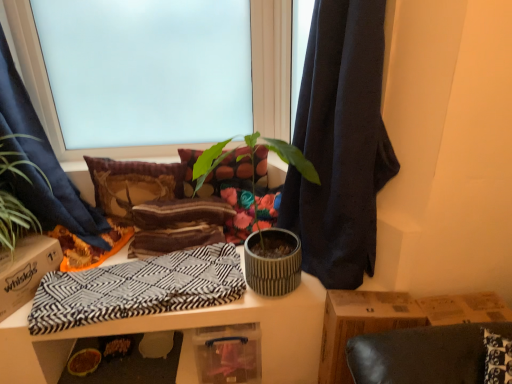
Question: Considering the relative positions of dark blue fabric at center, which ranks as the second curtain in left-to-right order, and textured concrete pot at center, which is the 1th houseplant in right-to-left order, in the image provided, is dark blue fabric at center, which ranks as the second curtain in left-to-right order, to the right of textured concrete pot at center, which is the 1th houseplant in right-to-left order, from the viewer's perspective?

Choices:
 (A) no
 (B) yes

Answer: (B)

Question: Is dark blue fabric at center, which ranks as the second curtain in left-to-right order, taller than textured concrete pot at center, which is the 1th houseplant in right-to-left order?

Choices:
 (A) yes
 (B) no

Answer: (A)

Question: Does dark blue fabric at center, the 1th curtain in the right-to-left sequence, come in front of textured concrete pot at center, which is the 1th houseplant in right-to-left order?

Choices:
 (A) no
 (B) yes

Answer: (B)

Question: From the image's perspective, is dark blue fabric at center, which ranks as the second curtain in left-to-right order, located above textured concrete pot at center, which is the 1th houseplant in right-to-left order?

Choices:
 (A) no
 (B) yes

Answer: (B)

Question: Is dark blue fabric at center, which ranks as the second curtain in left-to-right order, at the left side of textured concrete pot at center, positioned as the second houseplant in left-to-right order?

Choices:
 (A) yes
 (B) no

Answer: (B)

Question: Does point (173, 251) appear closer or farther from the camera than point (364, 69)?

Choices:
 (A) closer
 (B) farther

Answer: (B)

Question: From the image's perspective, relative to dark blue fabric at center, the 1th curtain in the right-to-left sequence, is black and white zigzag fabric at center above or below?

Choices:
 (A) above
 (B) below

Answer: (B)

Question: In the image, is black and white zigzag fabric at center positioned in front of or behind dark blue fabric at center, the 1th curtain in the right-to-left sequence?

Choices:
 (A) front
 (B) behind

Answer: (B)

Question: Is black and white zigzag fabric at center spatially inside dark blue fabric at center, which ranks as the second curtain in left-to-right order, or outside of it?

Choices:
 (A) inside
 (B) outside

Answer: (B)

Question: Considering the positions of textured fabric pillow at center, marked as the first pillow in a right-to-left arrangement, and blue fabric curtain at left, which is the 1th curtain from left to right, in the image, is textured fabric pillow at center, marked as the first pillow in a right-to-left arrangement, wider or thinner than blue fabric curtain at left, which is the 1th curtain from left to right,?

Choices:
 (A) wide
 (B) thin

Answer: (B)

Question: Visually, is textured fabric pillow at center, which appears as the second pillow when viewed from the left, positioned to the left or to the right of blue fabric curtain at left, which is the 1th curtain from left to right?

Choices:
 (A) right
 (B) left

Answer: (A)

Question: Is textured fabric pillow at center, which appears as the second pillow when viewed from the left, inside or outside of blue fabric curtain at left, which is the 1th curtain from left to right?

Choices:
 (A) outside
 (B) inside

Answer: (A)

Question: Based on their sizes in the image, would you say textured fabric pillow at center, marked as the first pillow in a right-to-left arrangement, is bigger or smaller than blue fabric curtain at left, which is the 1th curtain from left to right?

Choices:
 (A) small
 (B) big

Answer: (A)

Question: Considering the positions of point (25, 226) and point (258, 137), is point (25, 226) closer or farther from the camera than point (258, 137)?

Choices:
 (A) farther
 (B) closer

Answer: (B)

Question: Is green leafy plant at left, positioned as the 2th houseplant in right-to-left order, inside or outside of textured concrete pot at center, which is the 1th houseplant in right-to-left order?

Choices:
 (A) outside
 (B) inside

Answer: (A)